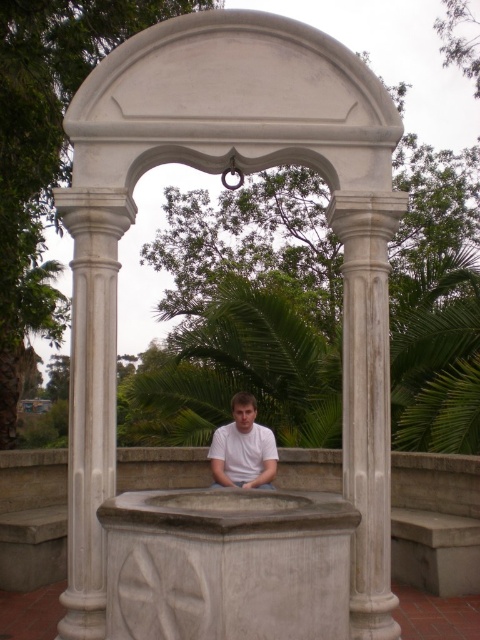
Question: Which point is closer to the camera?

Choices:
 (A) (93, 221)
 (B) (381, 241)

Answer: (A)

Question: Which point appears farthest from the camera in this image?

Choices:
 (A) (243, 458)
 (B) (75, 604)
 (C) (252, 33)
 (D) (345, 202)

Answer: (A)

Question: Can you confirm if white marble column at center is positioned above white matte shirt at center?

Choices:
 (A) no
 (B) yes

Answer: (B)

Question: Is the position of white marble pillar at center more distant than that of white matte shirt at center?

Choices:
 (A) yes
 (B) no

Answer: (B)

Question: Is white marble column at center wider than white marble column at left?

Choices:
 (A) yes
 (B) no

Answer: (B)

Question: Among these points, which one is nearest to the camera?

Choices:
 (A) (240, 451)
 (B) (96, 605)
 (C) (358, 241)
 (D) (135, 61)

Answer: (B)